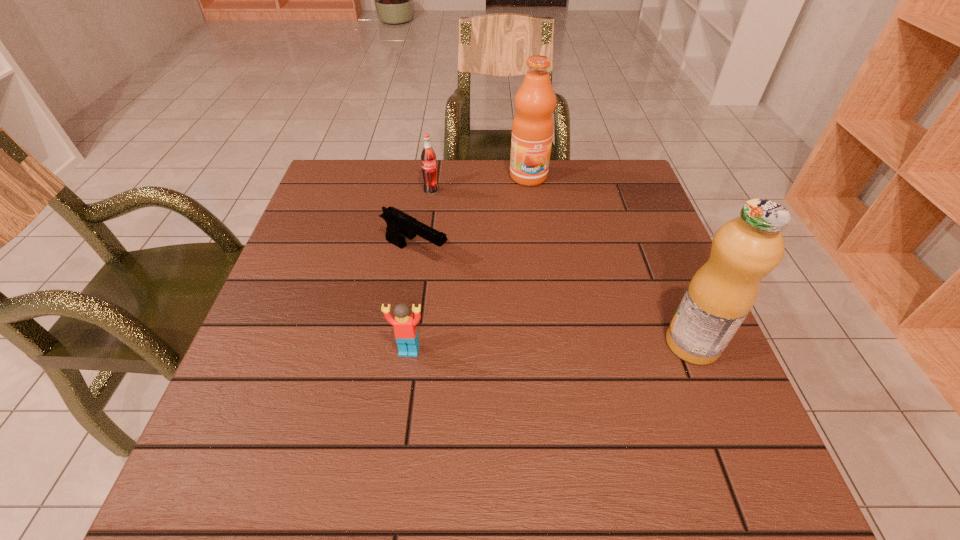
Locate which object is the third closest to the third tallest object. Please provide its 2D coordinates. Your answer should be formatted as a tuple, i.e. [(x, y)], where the tuple contains the x and y coordinates of a point satisfying the conditions above.

[(404, 322)]

Image resolution: width=960 pixels, height=540 pixels. Find the location of `object that is the closest to the pistol`. object that is the closest to the pistol is located at coordinates (428, 157).